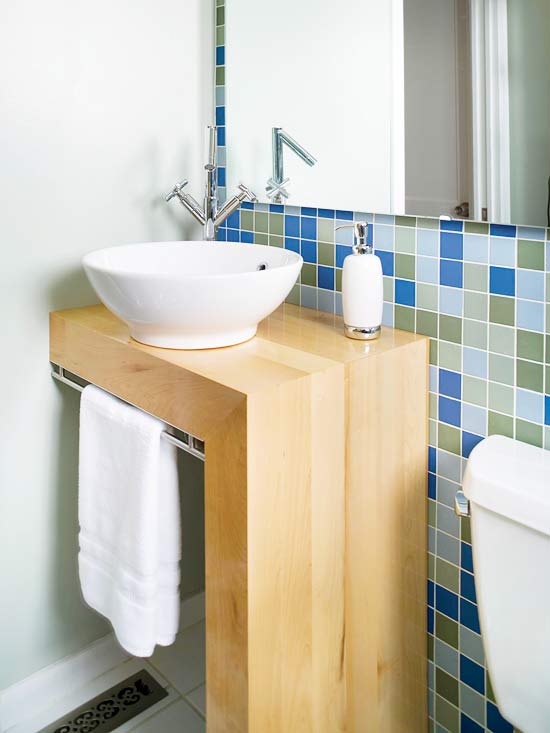
The image size is (550, 733). I want to click on knob, so click(x=456, y=512).